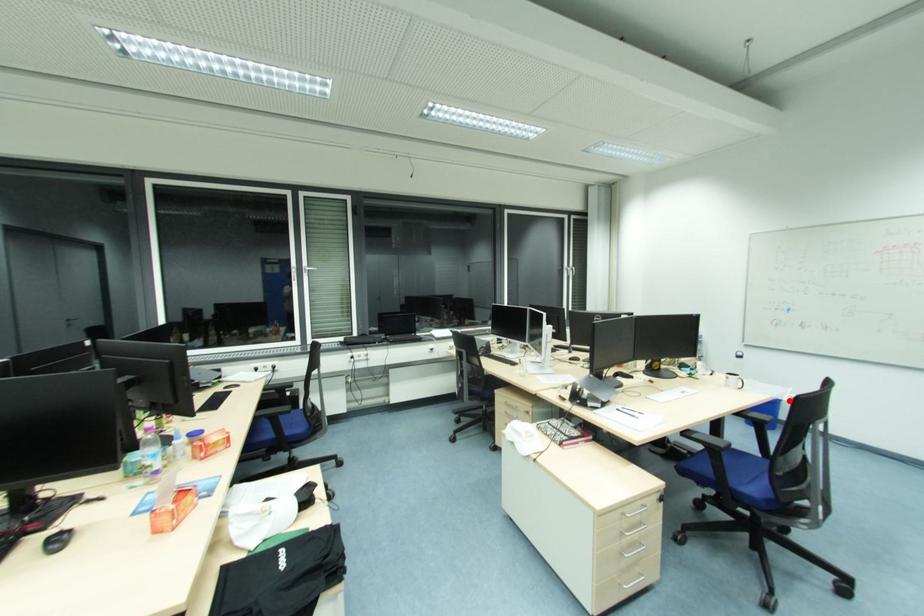
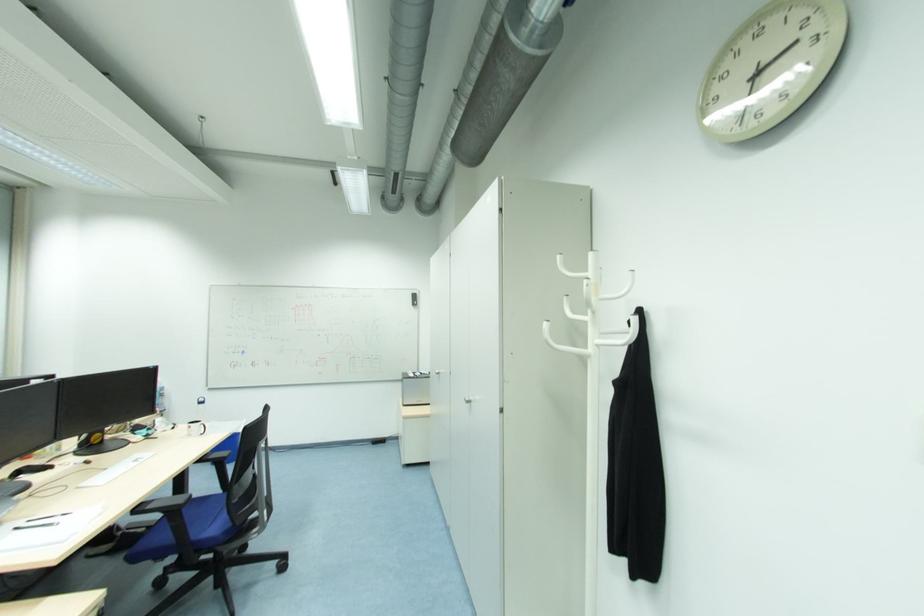
Where in the second image is the point corresponding to the highlighted location from the first image?

(244, 432)